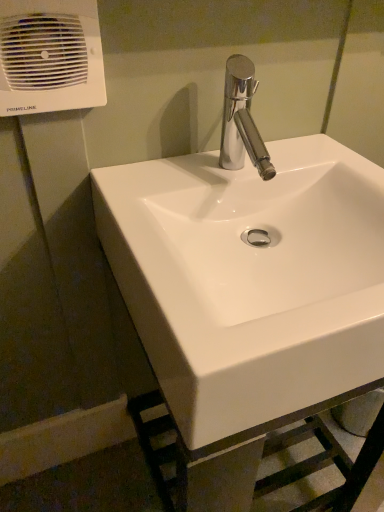
What do you see at coordinates (249, 278) in the screenshot? This screenshot has width=384, height=512. I see `white glossy sink at center` at bounding box center [249, 278].

You are a GUI agent. You are given a task and a screenshot of the screen. Output one action in this format:
    pyautogui.click(x=<x>, y=<y>)
    Task: Click on the white glossy sink at center
    This screenshot has width=384, height=512.
    Given the screenshot: What is the action you would take?
    pyautogui.click(x=249, y=278)

Where is `white plastic air conditioning unit at upper left`? This screenshot has width=384, height=512. white plastic air conditioning unit at upper left is located at coordinates (50, 56).

This screenshot has width=384, height=512. What do you see at coordinates (50, 56) in the screenshot?
I see `white plastic air conditioning unit at upper left` at bounding box center [50, 56].

Find the location of a particular element. The image size is (384, 512). white glossy sink at center is located at coordinates coord(249,278).

Is white glossy sink at center to the right of white plastic air conditioning unit at upper left from the viewer's perspective?

Correct, you'll find white glossy sink at center to the right of white plastic air conditioning unit at upper left.

Which object is closer to the camera taking this photo, white glossy sink at center or white plastic air conditioning unit at upper left?

white glossy sink at center is closer to the camera.

Is point (369, 210) closer or farther from the camera than point (17, 41)?

Point (369, 210) is positioned farther from the camera compared to point (17, 41).

From the image's perspective, who appears lower, white glossy sink at center or white plastic air conditioning unit at upper left?

white glossy sink at center, from the image's perspective.

Looking at this image, from a real-world perspective, who is located higher, white glossy sink at center or white plastic air conditioning unit at upper left?

From a 3D spatial view, white plastic air conditioning unit at upper left is above.

Is white glossy sink at center wider or thinner than white plastic air conditioning unit at upper left?

Clearly, white glossy sink at center has more width compared to white plastic air conditioning unit at upper left.

Who is shorter, white glossy sink at center or white plastic air conditioning unit at upper left?

With less height is white plastic air conditioning unit at upper left.

Is white glossy sink at center bigger or smaller than white plastic air conditioning unit at upper left?

Considering their sizes, white glossy sink at center takes up more space than white plastic air conditioning unit at upper left.

Would you say white glossy sink at center is inside or outside white plastic air conditioning unit at upper left?

white glossy sink at center is not enclosed by white plastic air conditioning unit at upper left.

Is white glossy sink at center next to white plastic air conditioning unit at upper left?

No, white glossy sink at center is not making contact with white plastic air conditioning unit at upper left.

Is white plastic air conditioning unit at upper left at the back of white glossy sink at center?

That's not correct — white glossy sink at center is not looking away from white plastic air conditioning unit at upper left.

How many degrees apart are the facing directions of white glossy sink at center and white plastic air conditioning unit at upper left?

0.00261 degrees.

In order to click on sink that appears in front of the white plastic air conditioning unit at upper left in this screenshot , I will do `click(249, 278)`.

In the scene shown: Considering the relative positions of white plastic air conditioning unit at upper left and white glossy sink at center in the image provided, is white plastic air conditioning unit at upper left to the left of white glossy sink at center from the viewer's perspective?

Indeed, white plastic air conditioning unit at upper left is positioned on the left side of white glossy sink at center.

Considering the relative positions of white plastic air conditioning unit at upper left and white glossy sink at center in the image provided, is white plastic air conditioning unit at upper left in front of white glossy sink at center?

No.

Does point (92, 39) appear closer or farther from the camera than point (277, 293)?

Point (92, 39).

From the picture: From the image's perspective, is white plastic air conditioning unit at upper left below white glossy sink at center?

No, from the image's perspective, white plastic air conditioning unit at upper left is not beneath white glossy sink at center.

From a real-world perspective, which object stands above the other?

From a 3D spatial view, white plastic air conditioning unit at upper left is above.

Considering the sizes of objects white plastic air conditioning unit at upper left and white glossy sink at center in the image provided, who is thinner, white plastic air conditioning unit at upper left or white glossy sink at center?

Thinner between the two is white plastic air conditioning unit at upper left.

Can you confirm if white plastic air conditioning unit at upper left is shorter than white glossy sink at center?

Correct, white plastic air conditioning unit at upper left is not as tall as white glossy sink at center.

Based on their sizes in the image, would you say white plastic air conditioning unit at upper left is bigger or smaller than white glossy sink at center?

Considering their sizes, white plastic air conditioning unit at upper left takes up less space than white glossy sink at center.

Do you think white plastic air conditioning unit at upper left is within white glossy sink at center, or outside of it?

white plastic air conditioning unit at upper left is not inside white glossy sink at center, it's outside.

Is white plastic air conditioning unit at upper left far from white glossy sink at center?

That's not correct — white plastic air conditioning unit at upper left is a little close to white glossy sink at center.

Is white plastic air conditioning unit at upper left turned away from white glossy sink at center?

No, white glossy sink at center is not at the back of white plastic air conditioning unit at upper left.

Identify the location of sink in front of the white plastic air conditioning unit at upper left. Image resolution: width=384 pixels, height=512 pixels. (249, 278).

You are a GUI agent. You are given a task and a screenshot of the screen. Output one action in this format:
    pyautogui.click(x=<x>, y=<y>)
    Task: Click on the sink on the right of white plastic air conditioning unit at upper left
    The image size is (384, 512).
    Given the screenshot: What is the action you would take?
    pyautogui.click(x=249, y=278)

The image size is (384, 512). In order to click on sink in front of the white plastic air conditioning unit at upper left in this screenshot , I will do `click(249, 278)`.